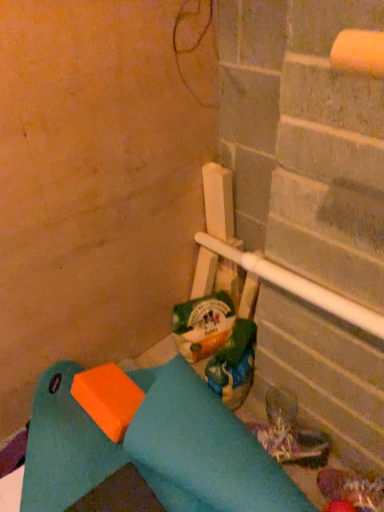
Question: In terms of size, does leather-like brown boot at lower right appear bigger or smaller than green plastic bag at center?

Choices:
 (A) big
 (B) small

Answer: (B)

Question: In terms of height, does leather-like brown boot at lower right look taller or shorter compared to green plastic bag at center?

Choices:
 (A) short
 (B) tall

Answer: (A)

Question: Is leather-like brown boot at lower right to the left or to the right of green plastic bag at center in the image?

Choices:
 (A) right
 (B) left

Answer: (A)

Question: From a real-world perspective, is green plastic bag at center positioned above or below leather-like brown boot at lower right?

Choices:
 (A) above
 (B) below

Answer: (A)

Question: In terms of height, does green plastic bag at center look taller or shorter compared to leather-like brown boot at lower right?

Choices:
 (A) tall
 (B) short

Answer: (A)

Question: Is green plastic bag at center wider or thinner than leather-like brown boot at lower right?

Choices:
 (A) wide
 (B) thin

Answer: (B)

Question: Looking at the image, does green plastic bag at center seem bigger or smaller compared to leather-like brown boot at lower right?

Choices:
 (A) big
 (B) small

Answer: (A)